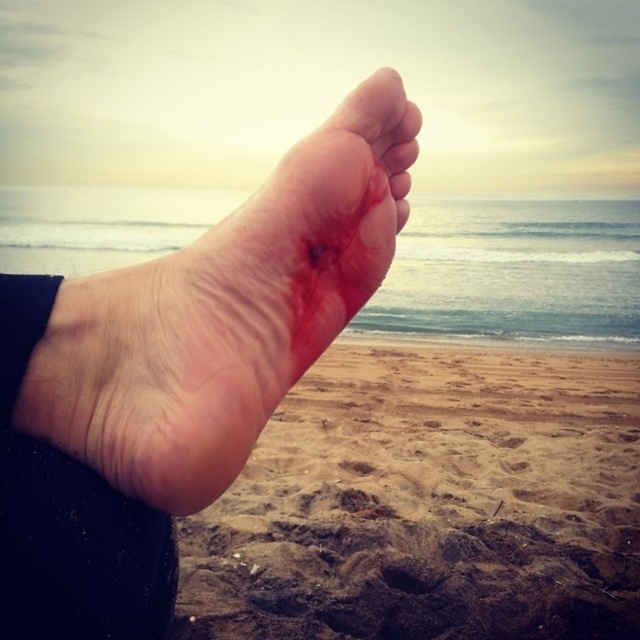
Is brown sandy beach at lower center below dry skin at center?

Yes.

Which is behind, point (548, 616) or point (365, 93)?

The point (548, 616) is behind.

Find the location of a particular element. brown sandy beach at lower center is located at coordinates tap(429, 502).

This screenshot has height=640, width=640. What are the coordinates of `brown sandy beach at lower center` in the screenshot? It's located at (429, 502).

Does brown sandy beach at lower center lie behind dry skin foot at center?

Yes, brown sandy beach at lower center is behind dry skin foot at center.

Can you confirm if brown sandy beach at lower center is positioned above dry skin foot at center?

Actually, brown sandy beach at lower center is below dry skin foot at center.

You are a GUI agent. You are given a task and a screenshot of the screen. Output one action in this format:
    pyautogui.click(x=<x>, y=<y>)
    Task: Click on the brown sandy beach at lower center
    The height and width of the screenshot is (640, 640).
    Given the screenshot: What is the action you would take?
    pyautogui.click(x=429, y=502)

Is dry skin foot at center positioned at the back of dry skin at center?

No, dry skin foot at center is in front of dry skin at center.

Between dry skin foot at center and dry skin at center, which one appears on the right side from the viewer's perspective?

From the viewer's perspective, dry skin at center appears more on the right side.

Which is behind, point (259, 321) or point (378, 131)?

Positioned behind is point (378, 131).

Identify the location of dry skin foot at center. (170, 384).